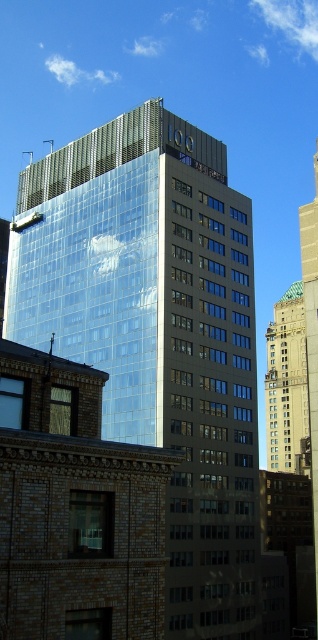
Between glassy reflective building at center and gold metallic bell tower at upper right, which one has less height?

Standing shorter between the two is gold metallic bell tower at upper right.

Does glassy reflective building at center appear under gold metallic bell tower at upper right?

No, glassy reflective building at center is not below gold metallic bell tower at upper right.

Image resolution: width=318 pixels, height=640 pixels. What are the coordinates of `glassy reflective building at center` in the screenshot? It's located at (157, 332).